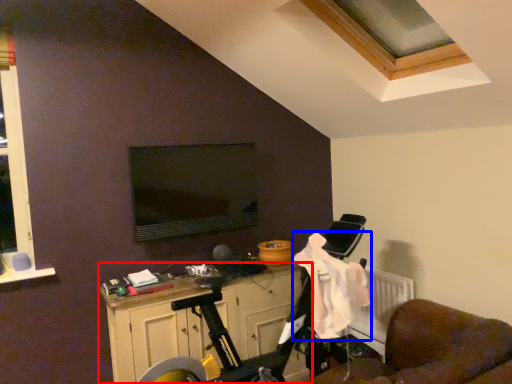
Question: Which of the following is the closest to the observer, cabinetry (highlighted by a red box) or laundry (highlighted by a blue box)?

Choices:
 (A) cabinetry
 (B) laundry

Answer: (B)